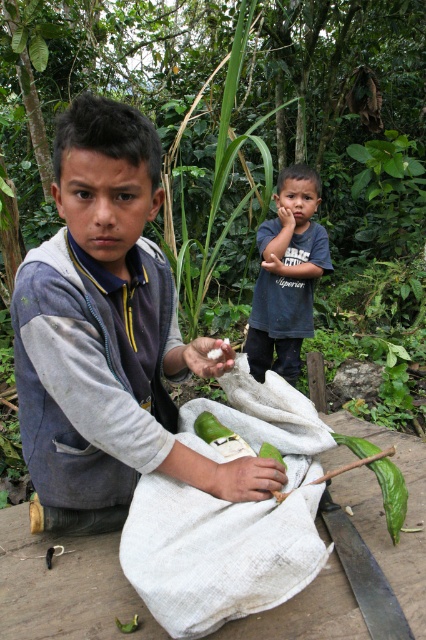
Question: In this image, where is gray fleece jacket at left located relative to white woven cloth at center?

Choices:
 (A) left
 (B) right

Answer: (A)

Question: Is white woven cloth at center thinner than dark blue t-shirt at upper center?

Choices:
 (A) no
 (B) yes

Answer: (B)

Question: Considering the real-world distances, which object is closest to the dark blue t-shirt at upper center?

Choices:
 (A) white woven cloth at center
 (B) gray fleece jacket at left

Answer: (B)

Question: Estimate the real-world distances between objects in this image. Which object is farther from the gray fleece jacket at left?

Choices:
 (A) white woven cloth at center
 (B) dark blue t-shirt at upper center

Answer: (B)

Question: Does gray fleece jacket at left appear over dark blue t-shirt at upper center?

Choices:
 (A) yes
 (B) no

Answer: (B)

Question: Based on their relative distances, which object is farther from the white woven cloth at center?

Choices:
 (A) dark blue t-shirt at upper center
 (B) gray fleece jacket at left

Answer: (A)